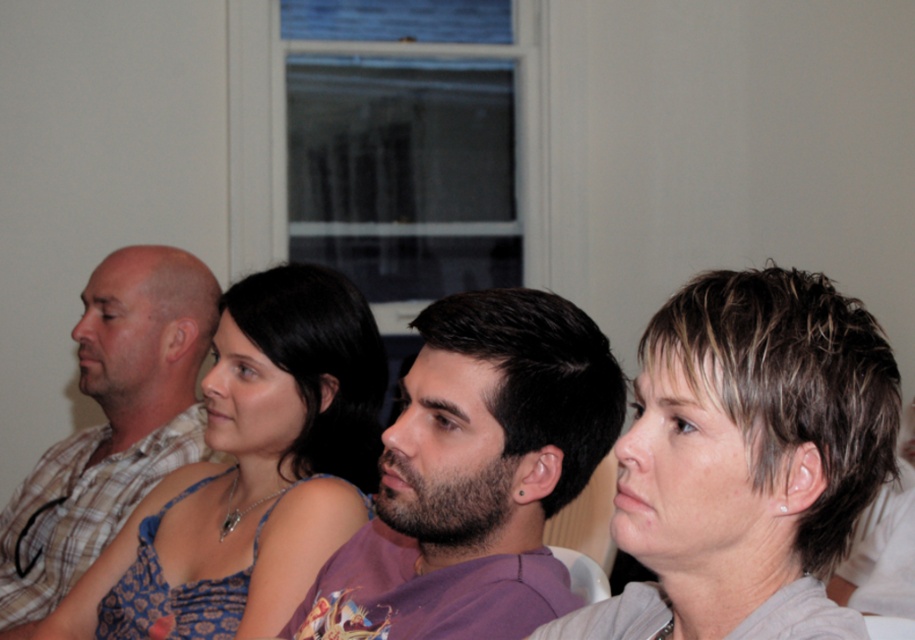
Question: Estimate the real-world distances between objects in this image. Which object is farther from the dark purple t-shirt at center?

Choices:
 (A) matte blue dress at center
 (B) short blonde hair at center

Answer: (A)

Question: Does short blonde hair at center appear on the right side of dark purple t-shirt at center?

Choices:
 (A) no
 (B) yes

Answer: (B)

Question: Which object is the closest to the dark purple t-shirt at center?

Choices:
 (A) short blonde hair at center
 (B) matte blue dress at center

Answer: (A)

Question: Among these objects, which one is farthest from the camera?

Choices:
 (A) matte blue dress at center
 (B) dark purple t-shirt at center

Answer: (A)

Question: Does short blonde hair at center have a larger size compared to matte blue dress at center?

Choices:
 (A) yes
 (B) no

Answer: (B)

Question: Is dark purple t-shirt at center bigger than matte blue dress at center?

Choices:
 (A) no
 (B) yes

Answer: (A)